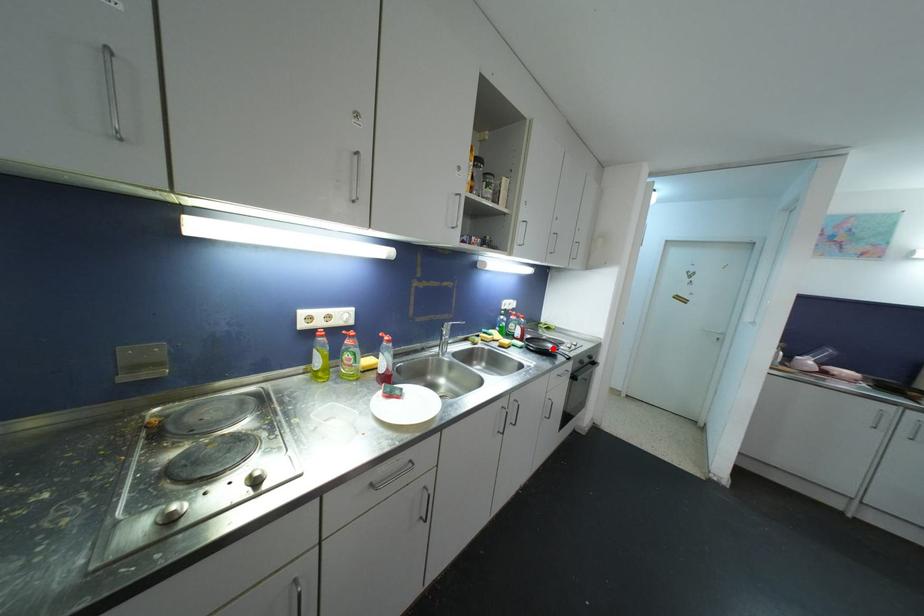
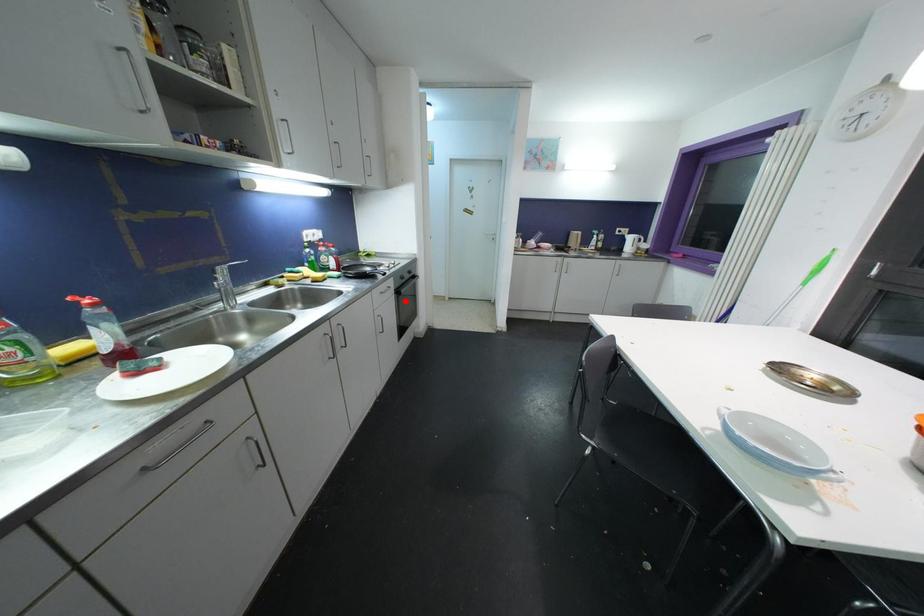
I am providing you with two images of the same scene from different viewpoints. A red point is marked on the first image and another point is marked on the second image. Is the marked point in image1 the same physical position as the marked point in image2?

No